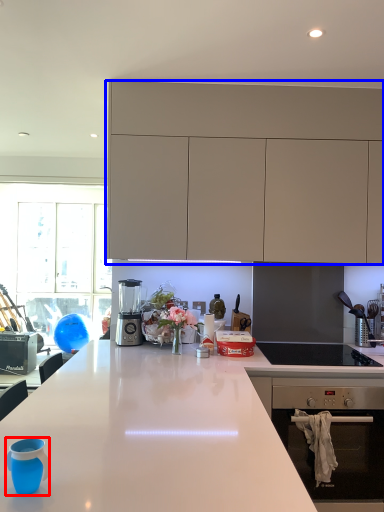
Question: Among these objects, which one is nearest to the camera, teal (highlighted by a red box) or cabinetry (highlighted by a blue box)?

Choices:
 (A) teal
 (B) cabinetry

Answer: (A)